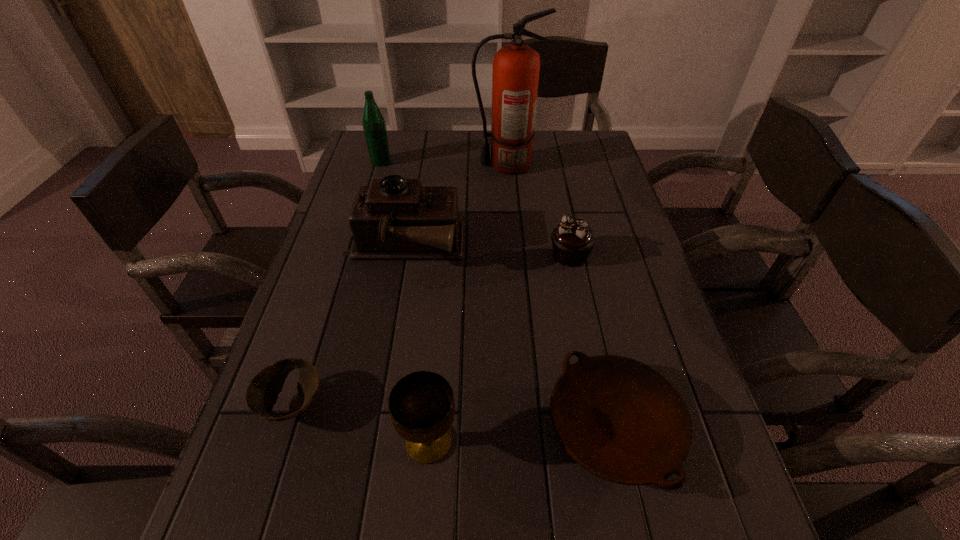
Where is `fire extinguisher`? fire extinguisher is located at coordinates (515, 76).

I want to click on the sixth shortest object, so click(x=374, y=125).

This screenshot has height=540, width=960. Find the location of `the fifth shortest object`. the fifth shortest object is located at coordinates (394, 218).

Where is `chalice`? The height and width of the screenshot is (540, 960). chalice is located at coordinates pos(421,404).

Locate an element on the screen. This screenshot has height=540, width=960. the third shortest object is located at coordinates (572, 240).

Where is `bowl`? bowl is located at coordinates [262, 392].

This screenshot has height=540, width=960. What are the coordinates of `plate` in the screenshot? It's located at (619, 419).

This screenshot has height=540, width=960. Identify the location of free space located on the nozzle of the fire extinguisher. (356, 165).

At what (x,y) coordinates should I click in order to perform the action: click on vacant area located on the nozzle of the fire extinguisher. Please return your answer as a coordinate pair (x, y). The width and height of the screenshot is (960, 540). Looking at the image, I should click on (433, 165).

Identify the location of free space located on the nozzle of the fire extinguisher. Image resolution: width=960 pixels, height=540 pixels. (430, 165).